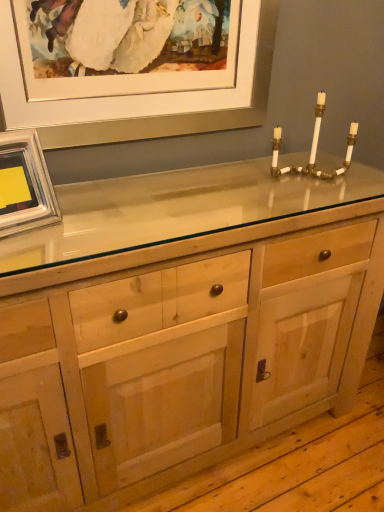
Question: Does white ceramic candle holder at upper right have a greater width compared to natural wood cabinet at center?

Choices:
 (A) no
 (B) yes

Answer: (A)

Question: Can you confirm if white ceramic candle holder at upper right is bigger than natural wood cabinet at center?

Choices:
 (A) yes
 (B) no

Answer: (B)

Question: From the image's perspective, would you say white ceramic candle holder at upper right is positioned over natural wood cabinet at center?

Choices:
 (A) yes
 (B) no

Answer: (A)

Question: From a real-world perspective, is white ceramic candle holder at upper right under natural wood cabinet at center?

Choices:
 (A) no
 (B) yes

Answer: (A)

Question: Is white ceramic candle holder at upper right not near natural wood cabinet at center?

Choices:
 (A) no
 (B) yes

Answer: (A)

Question: Is natural wood cabinet at center a part of white ceramic candle holder at upper right?

Choices:
 (A) no
 (B) yes

Answer: (A)

Question: Is matte white picture frame at upper center, the 1th picture frame positioned from the top, to the right of silver metallic picture frame at upper left, arranged as the first picture frame when ordered from the bottom, from the viewer's perspective?

Choices:
 (A) no
 (B) yes

Answer: (B)

Question: Is matte white picture frame at upper center, arranged as the second picture frame when ordered from the bottom, shorter than silver metallic picture frame at upper left, arranged as the 2th picture frame when viewed from the top?

Choices:
 (A) no
 (B) yes

Answer: (A)

Question: From the image's perspective, is matte white picture frame at upper center, arranged as the second picture frame when ordered from the bottom, located above silver metallic picture frame at upper left, arranged as the first picture frame when ordered from the bottom?

Choices:
 (A) yes
 (B) no

Answer: (A)

Question: Is matte white picture frame at upper center, arranged as the second picture frame when ordered from the bottom, further to camera compared to silver metallic picture frame at upper left, arranged as the first picture frame when ordered from the bottom?

Choices:
 (A) yes
 (B) no

Answer: (A)

Question: Could you tell me if matte white picture frame at upper center, arranged as the second picture frame when ordered from the bottom, is turned towards silver metallic picture frame at upper left, arranged as the first picture frame when ordered from the bottom?

Choices:
 (A) no
 (B) yes

Answer: (B)

Question: Considering the relative sizes of matte white picture frame at upper center, arranged as the second picture frame when ordered from the bottom, and silver metallic picture frame at upper left, arranged as the 2th picture frame when viewed from the top, in the image provided, is matte white picture frame at upper center, arranged as the second picture frame when ordered from the bottom, wider than silver metallic picture frame at upper left, arranged as the 2th picture frame when viewed from the top,?

Choices:
 (A) yes
 (B) no

Answer: (A)

Question: Can you confirm if matte white picture frame at upper center, arranged as the second picture frame when ordered from the bottom, is shorter than natural wood cabinet at center?

Choices:
 (A) yes
 (B) no

Answer: (A)